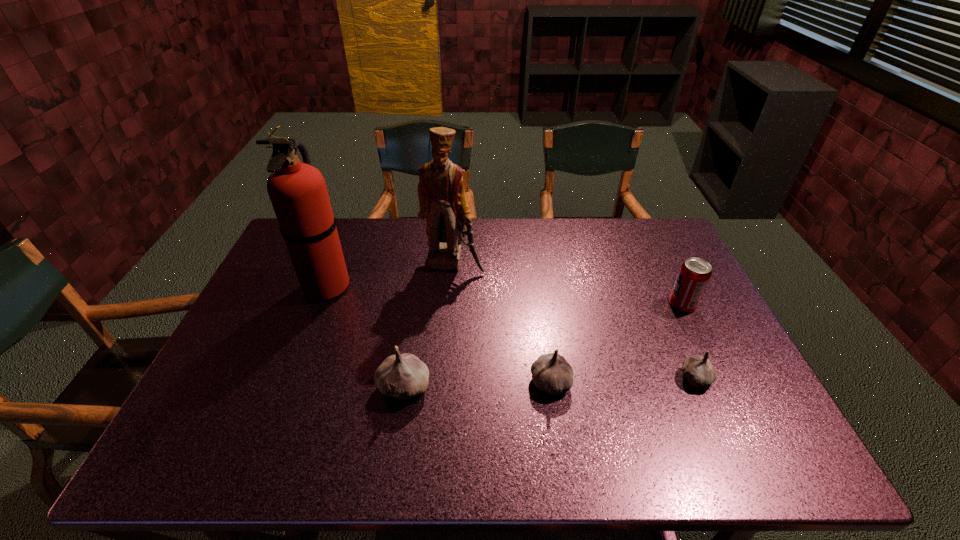
At what (x,y) coordinates should I click in order to perform the action: click on vacant space located 0.360m on the back of the shortest garlic. Please return your answer as a coordinate pair (x, y). This screenshot has width=960, height=540. Looking at the image, I should click on (648, 272).

Where is `vacant space located 0.230m on the left of the soda can`? The image size is (960, 540). vacant space located 0.230m on the left of the soda can is located at coordinates (590, 305).

Locate an element on the screen. This screenshot has height=540, width=960. free region located on the front-facing side of the nutcracker is located at coordinates (446, 353).

The width and height of the screenshot is (960, 540). I want to click on vacant space located at the nozzle of the leftmost object, so click(410, 286).

Identify the location of object that is at the far edge. This screenshot has width=960, height=540. (442, 200).

Find the location of `object that is at the left edge`. object that is at the left edge is located at coordinates (298, 193).

What are the coordinates of `garlic positioned at the right edge` in the screenshot? It's located at (699, 371).

The width and height of the screenshot is (960, 540). Find the location of `soda can positioned at the right edge`. soda can positioned at the right edge is located at coordinates (694, 274).

Identify the location of object that is at the near right corner. The width and height of the screenshot is (960, 540). (699, 371).

Where is `free region at the far edge of the desktop`? This screenshot has height=540, width=960. free region at the far edge of the desktop is located at coordinates (397, 241).